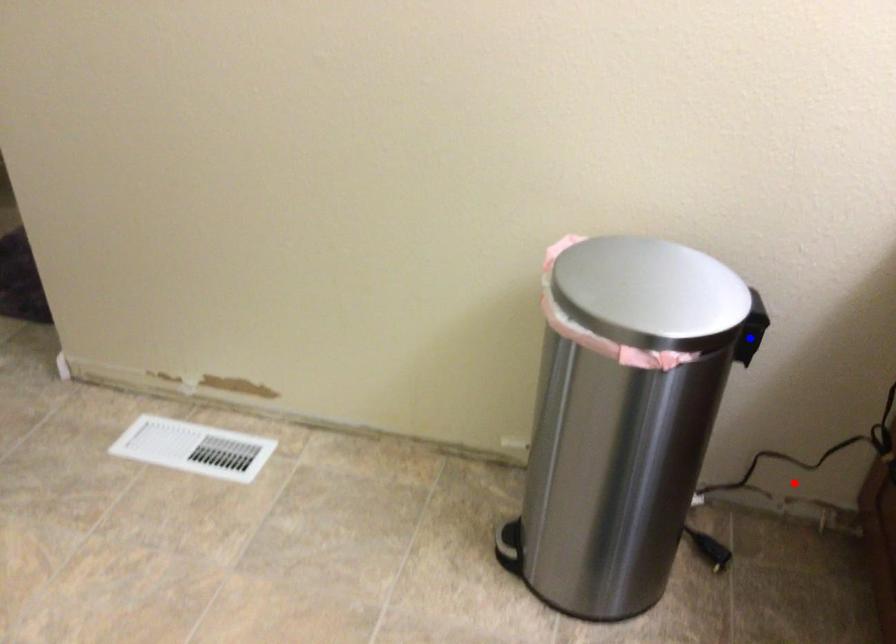
Question: In the image, two points are highlighted. Which point is nearer to the camera? Reply with the corresponding letter.

Choices:
 (A) blue point
 (B) red point

Answer: (A)